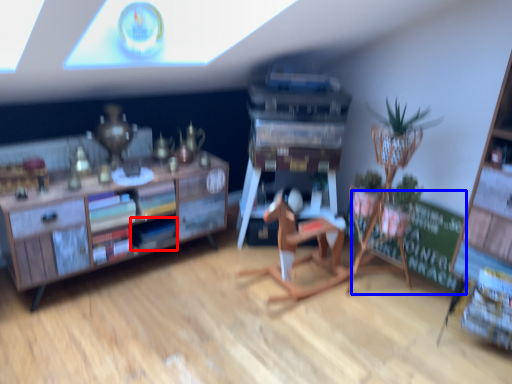
Question: Among these objects, which one is farthest to the camera, book (highlighted by a red box) or bulletin board (highlighted by a blue box)?

Choices:
 (A) book
 (B) bulletin board

Answer: (B)